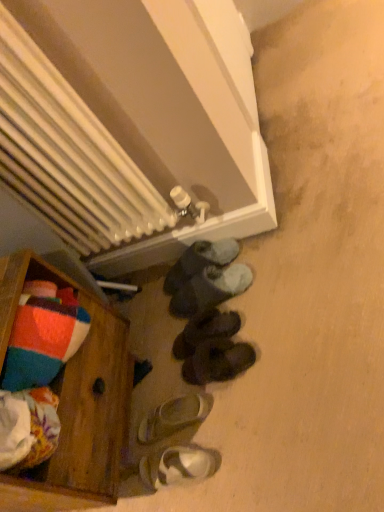
Find the location of a particular element. vacant space situated on the left part of white matte sandals at lower center, placed as the sixth footwear when sorted from top to bottom is located at coordinates (141, 490).